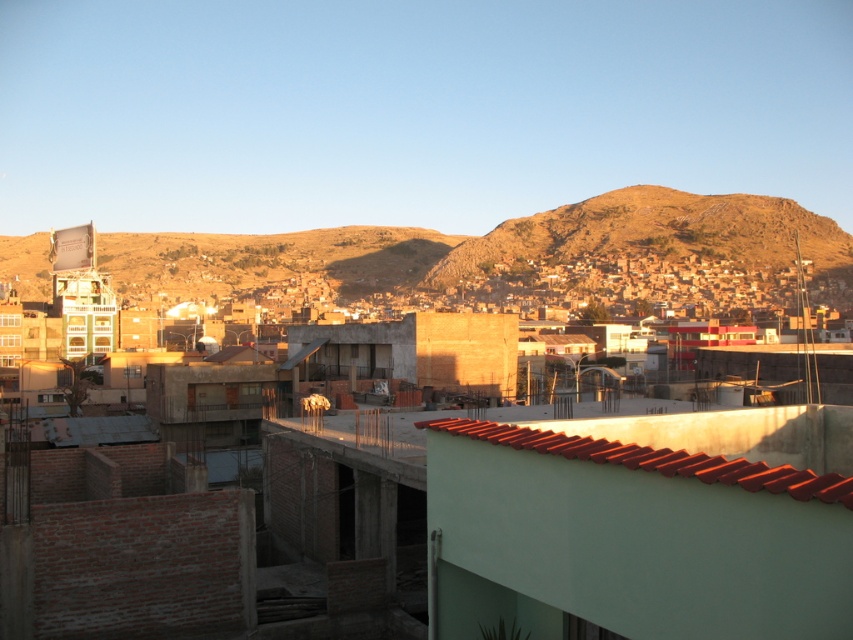
Question: Which object appears closest to the camera in this image?

Choices:
 (A) brown rocky hillside at upper center
 (B) red clay tiles at center

Answer: (B)

Question: Is brown rocky hillside at upper center in front of red clay tiles at center?

Choices:
 (A) no
 (B) yes

Answer: (A)

Question: In this image, where is brown rocky hillside at upper center located relative to red clay tiles at center?

Choices:
 (A) below
 (B) above

Answer: (B)

Question: Which point is farther to the camera?

Choices:
 (A) brown rocky hillside at upper center
 (B) red clay tiles at center

Answer: (A)

Question: In this image, where is brown rocky hillside at upper center located relative to red clay tiles at center?

Choices:
 (A) below
 (B) above

Answer: (B)